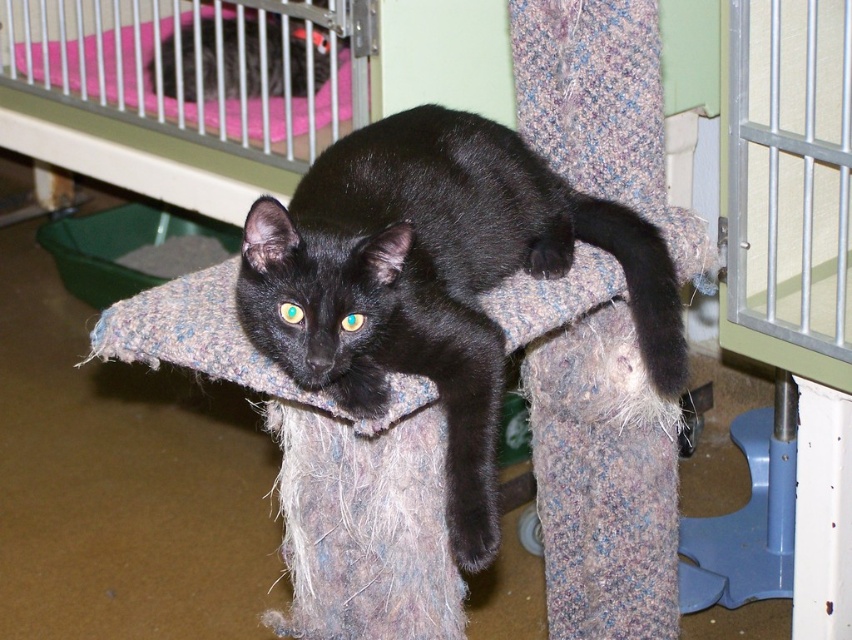
You are a visitor at the shelter and want to know if the black fur cat at upper left is above the black fur cat at center. Can you confirm this?

Yes, the black fur cat at upper left is above the black fur cat at center according to the description.

You are a cat owner who wants to ensure your black fur cat at center has enough space to move around its enclosure. The enclosure also contains a pink fabric infant bed at upper left. Based on the image, which object takes up more horizontal space?

The pink fabric infant bed at upper left takes up more horizontal space than the black fur cat at center because the black fur cat at center is narrower in width compared to the pink fabric infant bed at upper left.

From the picture: You are a visitor at the shelter and want to place a toy for the black fur cat at center. The toy needs to be placed in a location that is not under the pink fabric infant bed at upper left. Where should you place the toy?

The black fur cat at center is positioned under the pink fabric infant bed at upper left, so to place the toy away from that area, you should put it somewhere else in the shelter where it is not under the pink fabric infant bed at upper left.